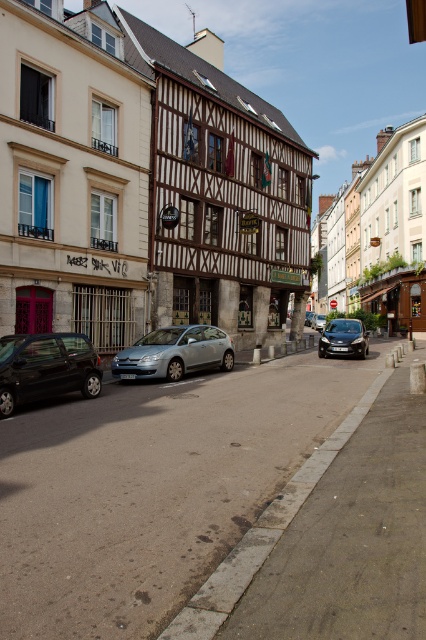
You are standing at the point marked by the coordinates point [143,182] in the image. Based on the scene description, what type of building are you facing?

The point [143,182] marks the brown wooden building at center, which has a half timbered facade with wooden beams and white plaster infill, dormer windows on the roof, and a sign reading BAYIK above its entrance, suggesting it is likely a restaurant or cafe.

You are a delivery driver who needs to park your satin silver car at center in a parking spot that can only accommodate vehicles up to the size of the white wooden building at center. Will your car fit?

The white wooden building at center is wider than the satin silver car at center. Since the parking spot can accommodate the building size, the car will fit as it is narrower than the building.

You are a delivery person with a truck that is 2 meters wide. You need to park between the white wooden building at center and the satin black car at center. Based on the scene, can your truck fit in the space between them?

The white wooden building at center might be wider than the satin black car at center, so the space between them may be sufficient for your 2 meter wide truck. However, since the exact width difference isn t specified, it s uncertain. You should measure the space before deciding to park there.